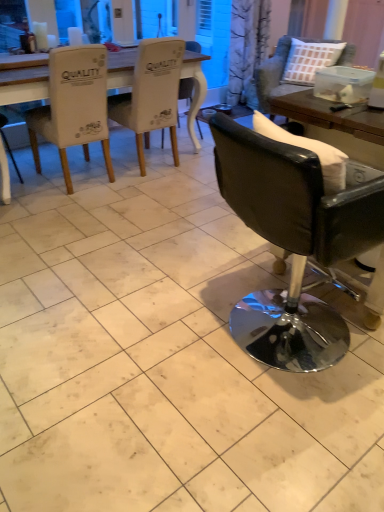
Question: Based on their positions, is white fabric chair at center, the third chair when ordered from left to right, located to the left or right of white fabric chair at upper left, which ranks as the 1th chair in left-to-right order?

Choices:
 (A) right
 (B) left

Answer: (A)

Question: Would you say white fabric chair at center, the third chair when ordered from left to right, is inside or outside white fabric chair at upper left, the fifth chair viewed from the right?

Choices:
 (A) outside
 (B) inside

Answer: (A)

Question: Estimate the real-world distances between objects in this image. Which object is farther from the white fabric chair at upper left, which ranks as the 1th chair in left-to-right order?

Choices:
 (A) black leather chair at right, acting as the 2th chair starting from the right
 (B) black leather chair at right, which ranks as the 1th chair in right-to-left order
 (C) white fabric chair at center, which ranks as the 3th chair in right-to-left order
 (D) white fabric table at upper left
 (E) white fabric chair at upper left, which is counted as the second chair, starting from the left

Answer: (A)

Question: Based on their relative distances, which object is farther from the white fabric table at upper left?

Choices:
 (A) black leather chair at right, which ranks as the 1th chair in right-to-left order
 (B) white fabric chair at upper left, which is counted as the second chair, starting from the left
 (C) black leather chair at right, the fourth chair when ordered from left to right
 (D) white fabric chair at center, which ranks as the 3th chair in right-to-left order
 (E) white fabric chair at upper left, the fifth chair viewed from the right

Answer: (C)